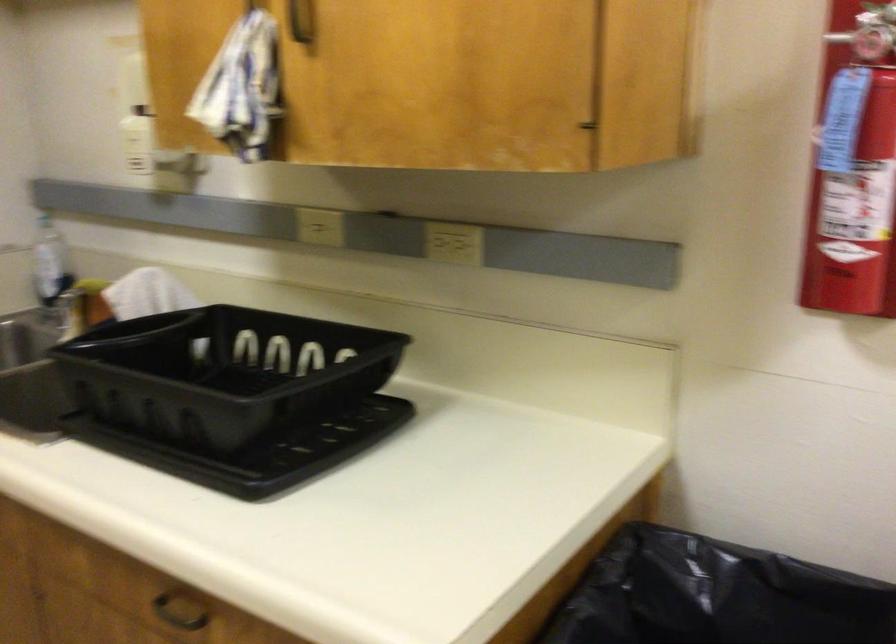
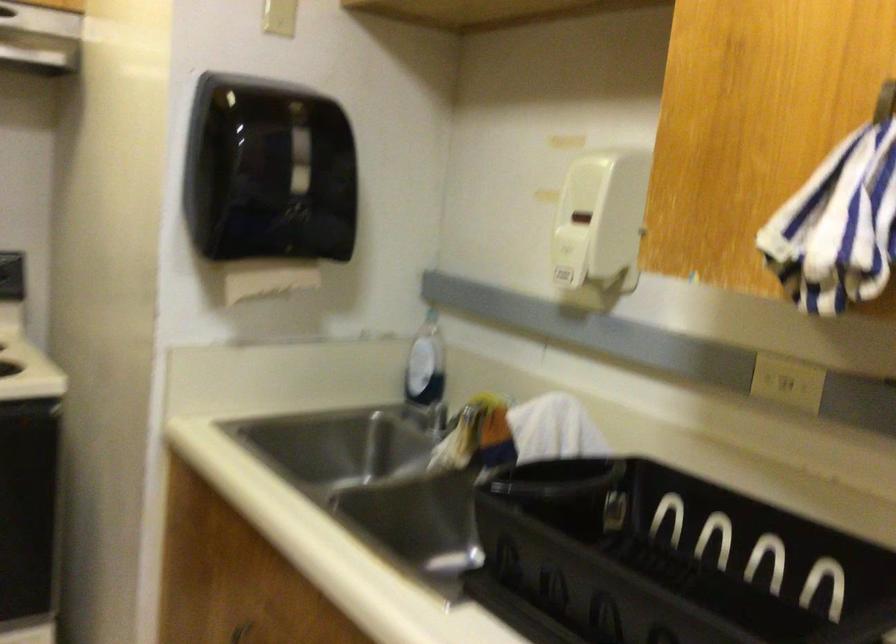
From the picture: In a continuous first-person perspective shot, in which direction is the camera moving?

The cameraman walked toward left, forward.